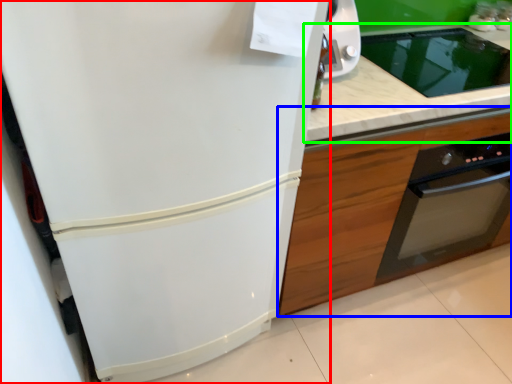
Question: Which object is positioned closest to refrigerator (highlighted by a red box)? Select from cabinetry (highlighted by a blue box) and countertop (highlighted by a green box).

Choices:
 (A) cabinetry
 (B) countertop

Answer: (A)